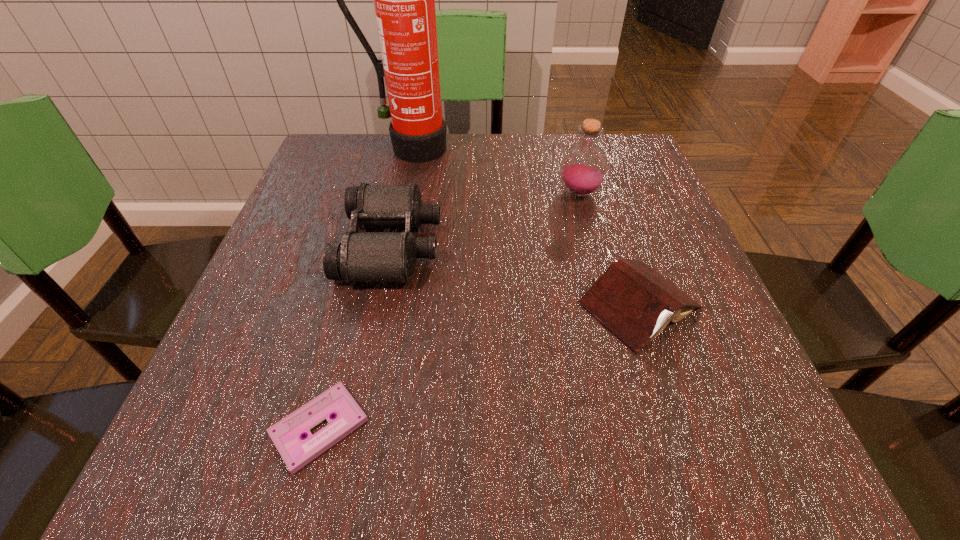
Locate an element on the screen. The image size is (960, 540). free spot between the binoculars and the book is located at coordinates click(516, 275).

I want to click on vacant space in between the fourth tallest object and the tallest object, so click(525, 227).

Identify the location of free space between the book and the bottle. The width and height of the screenshot is (960, 540). (610, 249).

This screenshot has height=540, width=960. Identify the location of empty space between the book and the tallest object. (525, 227).

Identify the location of vacant space in between the second shortest object and the fourth shortest object. This screenshot has height=540, width=960. (610, 249).

Identify which object is the third closest to the second tallest object. Please provide its 2D coordinates. Your answer should be formatted as a tuple, i.e. [(x, y)], where the tuple contains the x and y coordinates of a point satisfying the conditions above.

[(361, 256)]

Find the location of a particular element. The width and height of the screenshot is (960, 540). object that stands as the third closest to the fourth tallest object is located at coordinates (287, 434).

Identify the location of free location that satisfies the following two spatial constraints: 1. on the back side of the second shortest object; 2. through the eyepieces of the binoculars. (620, 245).

The width and height of the screenshot is (960, 540). I want to click on free region that satisfies the following two spatial constraints: 1. through the eyepieces of the third tallest object; 2. on the left side of the fourth tallest object, so click(x=379, y=305).

This screenshot has width=960, height=540. Find the location of `free point that satisfies the following two spatial constraints: 1. through the eyepieces of the binoculars; 2. on the back side of the book`. free point that satisfies the following two spatial constraints: 1. through the eyepieces of the binoculars; 2. on the back side of the book is located at coordinates (379, 305).